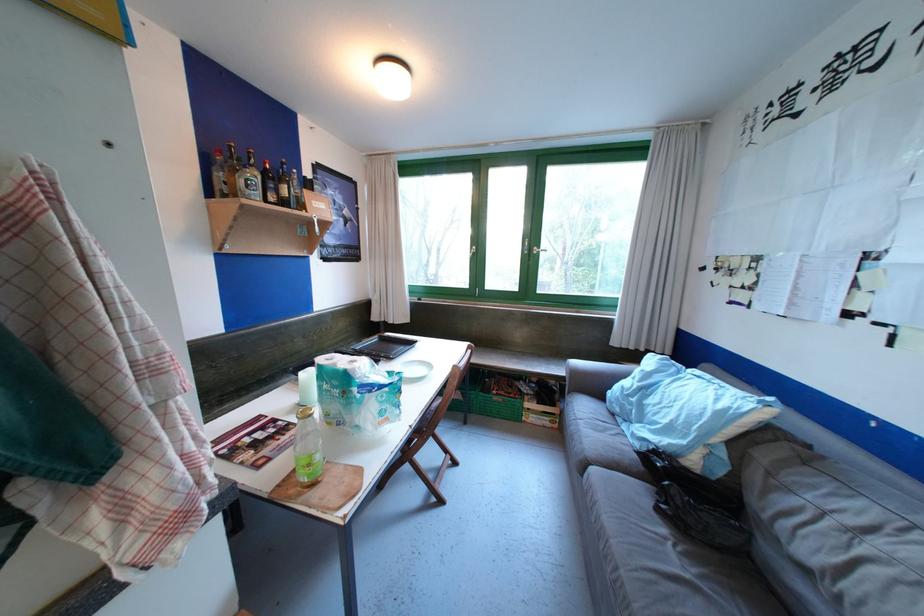
Describe the element at coordinates (699, 554) in the screenshot. This screenshot has height=616, width=924. I see `the sofa sitting surface` at that location.